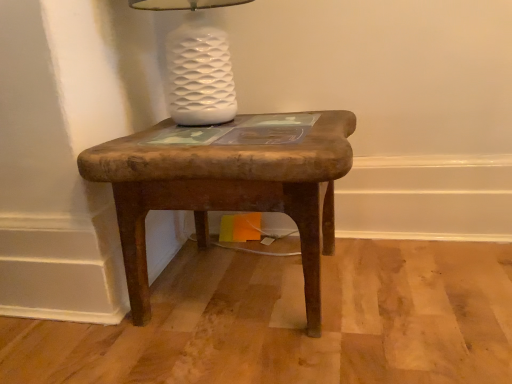
Question: Looking at their shapes, would you say white glossy lamp at upper center is wider or thinner than rustic wood stool at center?

Choices:
 (A) thin
 (B) wide

Answer: (A)

Question: Considering the positions of point (221, 76) and point (137, 231), is point (221, 76) closer or farther from the camera than point (137, 231)?

Choices:
 (A) farther
 (B) closer

Answer: (A)

Question: Considering the relative positions of white glossy lamp at upper center and rustic wood stool at center in the image provided, is white glossy lamp at upper center to the left or to the right of rustic wood stool at center?

Choices:
 (A) left
 (B) right

Answer: (A)

Question: Is rustic wood stool at center spatially inside white glossy lamp at upper center, or outside of it?

Choices:
 (A) outside
 (B) inside

Answer: (A)

Question: Based on their positions, is rustic wood stool at center located to the left or right of white glossy lamp at upper center?

Choices:
 (A) right
 (B) left

Answer: (A)

Question: Is point (310, 254) closer or farther from the camera than point (182, 92)?

Choices:
 (A) farther
 (B) closer

Answer: (B)

Question: Looking at their shapes, would you say rustic wood stool at center is wider or thinner than white glossy lamp at upper center?

Choices:
 (A) wide
 (B) thin

Answer: (A)